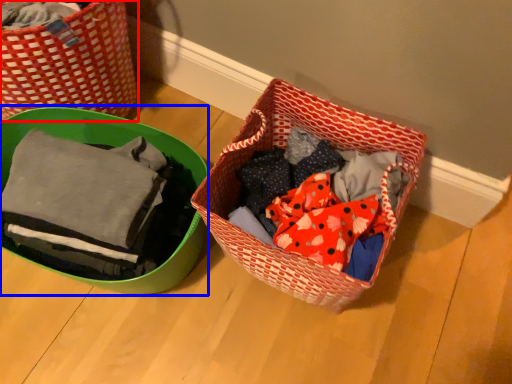
Question: Which object is closer to the camera taking this photo, picnic basket (highlighted by a red box) or gift basket (highlighted by a blue box)?

Choices:
 (A) picnic basket
 (B) gift basket

Answer: (B)